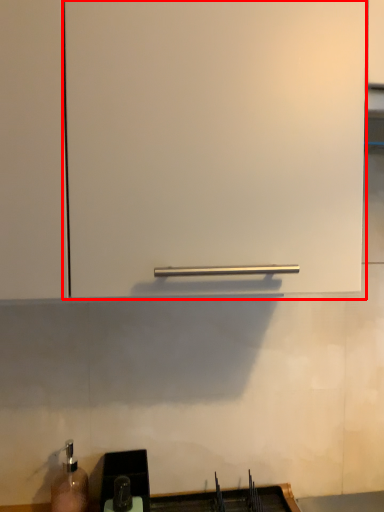
Question: From the image's perspective, where is cabinetry (annotated by the red box) located in relation to sink in the image?

Choices:
 (A) below
 (B) above

Answer: (B)